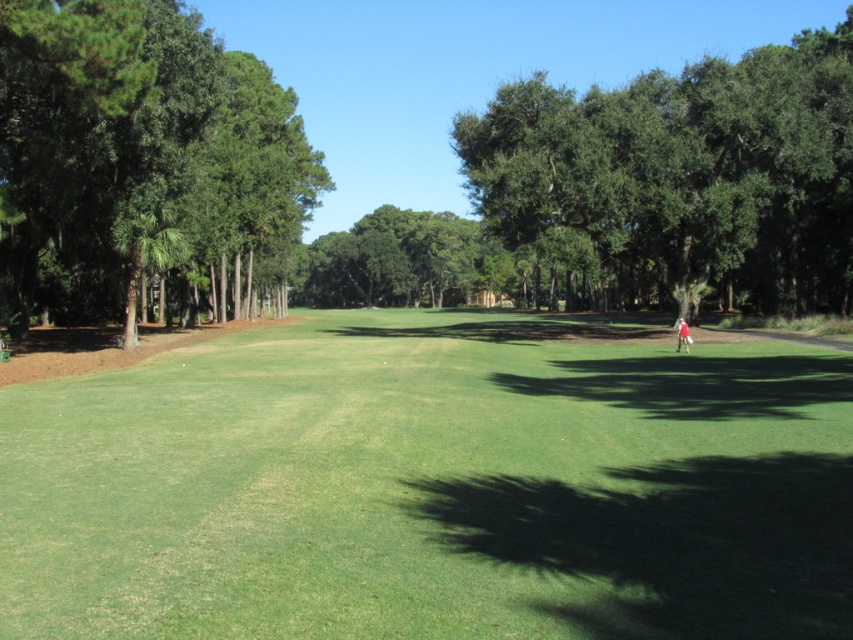
You are a golfer standing on the fairway and see both the green leafy tree at right and the green leafy tree at left in your line of sight. Which tree would block your view first if you were to walk straight towards them?

The green leafy tree at left would block your view first because it is closer to you than the green leafy tree at right, which is further away.

Looking at this image, you are a golfer standing at the tee, looking towards the green leafy tree at left and the red fabric golfer at center. Which object is bigger in the image?

The green leafy tree at left is larger in size compared to the red fabric golfer at center.

Looking at this image, you are a golfer standing on the fairway and you see the green leafy tree at right and the green leafy tree at left. Which tree has a wider trunk?

The green leafy tree at right has a wider trunk than the green leafy tree at left.